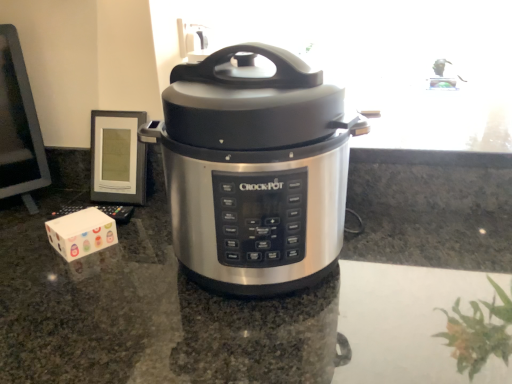
Question: Considering their positions, is stainless steel slow cooker at center located in front of or behind white cardboard box at lower left?

Choices:
 (A) behind
 (B) front

Answer: (B)

Question: Is stainless steel slow cooker at center bigger or smaller than white cardboard box at lower left?

Choices:
 (A) small
 (B) big

Answer: (B)

Question: Which of these objects is positioned closest to the stainless steel countertop at center?

Choices:
 (A) white cardboard box at lower left
 (B) stainless steel slow cooker at center

Answer: (B)

Question: Considering the real-world distances, which object is closest to the white cardboard box at lower left?

Choices:
 (A) stainless steel slow cooker at center
 (B) stainless steel countertop at center

Answer: (B)